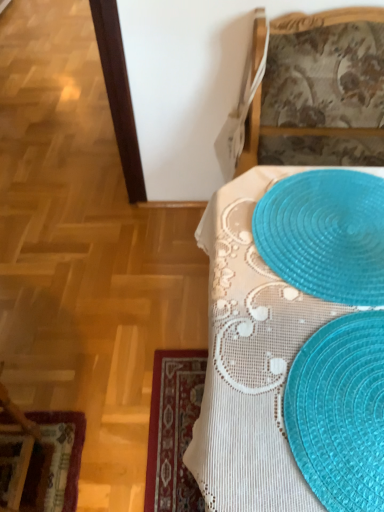
Question: Is translucent plastic placemat at upper right not near translucent blue placemat at lower right?

Choices:
 (A) yes
 (B) no

Answer: (B)

Question: From a real-world perspective, does translucent plastic placemat at upper right stand above translucent blue placemat at lower right?

Choices:
 (A) yes
 (B) no

Answer: (A)

Question: Considering the relative positions of translucent plastic placemat at upper right and translucent blue placemat at lower right in the image provided, is translucent plastic placemat at upper right to the right of translucent blue placemat at lower right from the viewer's perspective?

Choices:
 (A) yes
 (B) no

Answer: (B)

Question: Is translucent plastic placemat at upper right closer to the viewer compared to translucent blue placemat at lower right?

Choices:
 (A) yes
 (B) no

Answer: (B)

Question: From the image's perspective, is translucent plastic placemat at upper right on translucent blue placemat at lower right?

Choices:
 (A) no
 (B) yes

Answer: (B)

Question: From the image's perspective, is translucent plastic placemats at lower right located above or below translucent plastic placemat at upper right?

Choices:
 (A) below
 (B) above

Answer: (A)

Question: From a real-world perspective, is translucent plastic placemats at lower right positioned above or below translucent plastic placemat at upper right?

Choices:
 (A) below
 (B) above

Answer: (B)

Question: Is translucent plastic placemats at lower right inside the boundaries of translucent plastic placemat at upper right, or outside?

Choices:
 (A) outside
 (B) inside

Answer: (A)

Question: Is translucent plastic placemats at lower right in front of or behind translucent plastic placemat at upper right in the image?

Choices:
 (A) front
 (B) behind

Answer: (A)

Question: Considering their positions, is translucent blue placemat at lower right located in front of or behind translucent plastic placemat at upper right?

Choices:
 (A) behind
 (B) front

Answer: (B)

Question: Would you say translucent blue placemat at lower right is inside or outside translucent plastic placemat at upper right?

Choices:
 (A) inside
 (B) outside

Answer: (B)

Question: Considering the positions of translucent blue placemat at lower right and translucent plastic placemat at upper right in the image, is translucent blue placemat at lower right bigger or smaller than translucent plastic placemat at upper right?

Choices:
 (A) big
 (B) small

Answer: (B)

Question: From a real-world perspective, is translucent blue placemat at lower right above or below translucent plastic placemat at upper right?

Choices:
 (A) below
 (B) above

Answer: (B)

Question: From a real-world perspective, relative to velvet burgundy placemat at lower left, is translucent plastic placemat at upper right vertically above or below?

Choices:
 (A) below
 (B) above

Answer: (B)

Question: Is translucent plastic placemat at upper right wider or thinner than velvet burgundy placemat at lower left?

Choices:
 (A) wide
 (B) thin

Answer: (A)